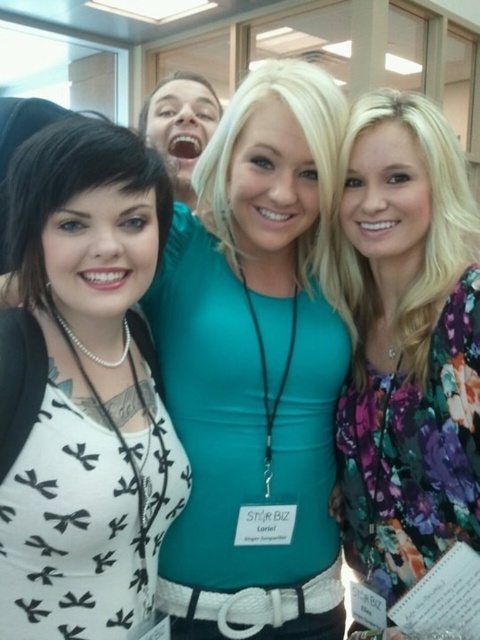
Based on the photo, is white matte/black textured bow tie at center bigger than floral print blouse at right?

Incorrect, white matte/black textured bow tie at center is not larger than floral print blouse at right.

Who is more distant from viewer, (48, 416) or (416, 408)?

Point (416, 408)

You are a GUI agent. You are given a task and a screenshot of the screen. Output one action in this format:
    pyautogui.click(x=<x>, y=<y>)
    Task: Click on the white matte/black textured bow tie at center
    The width and height of the screenshot is (480, 640).
    Given the screenshot: What is the action you would take?
    pyautogui.click(x=83, y=388)

At what (x,y) coordinates should I click in order to perform the action: click on white matte/black textured bow tie at center. Please return your answer as a coordinate pair (x, y). The width and height of the screenshot is (480, 640). Looking at the image, I should click on (83, 388).

Does white matte shirt at center have a greater height compared to floral print blouse at right?

Indeed, white matte shirt at center has a greater height compared to floral print blouse at right.

Can you confirm if white matte shirt at center is thinner than floral print blouse at right?

In fact, white matte shirt at center might be wider than floral print blouse at right.

Which is in front, point (197, 500) or point (477, 365)?

Point (477, 365)

What are the coordinates of `white matte shirt at center` in the screenshot? It's located at (257, 365).

Is white matte shirt at center in front of white matte/black textured bow tie at center?

That is False.

Is white matte shirt at center to the right of white matte/black textured bow tie at center from the viewer's perspective?

Correct, you'll find white matte shirt at center to the right of white matte/black textured bow tie at center.

At what (x,y) coordinates should I click in order to perform the action: click on white matte shirt at center. Please return your answer as a coordinate pair (x, y). This screenshot has height=640, width=480. Looking at the image, I should click on tap(257, 365).